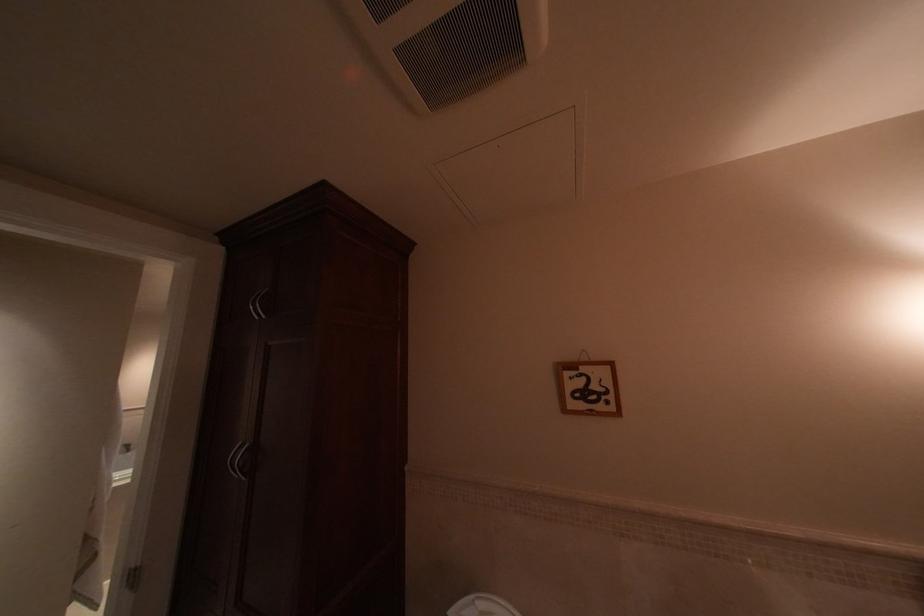
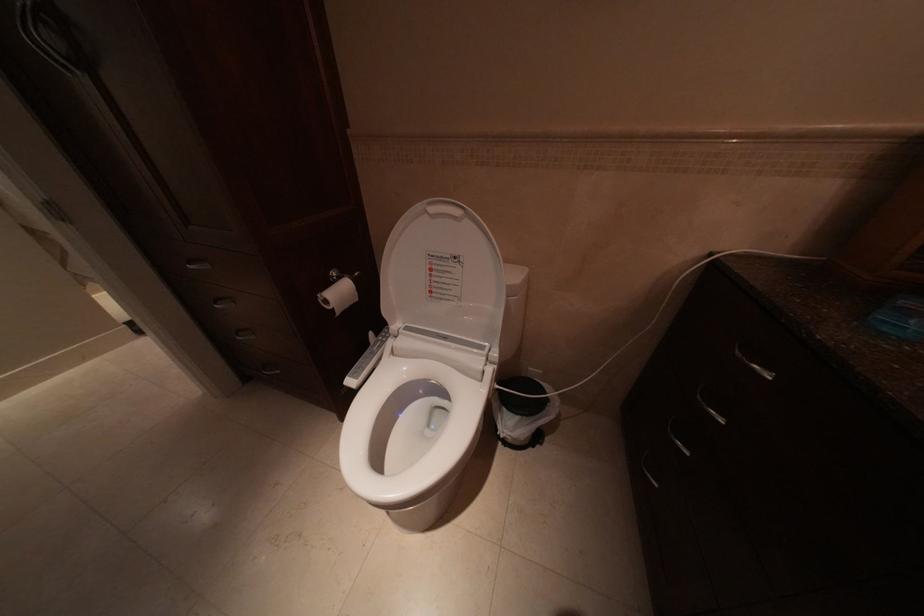
Question: The first image is from the beginning of the video and the second image is from the end. How did the camera likely rotate when shooting the video?

Choices:
 (A) Left
 (B) Right
 (C) Up
 (D) Down

Answer: (D)